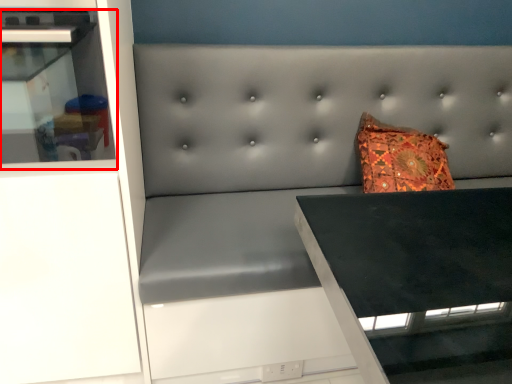
Question: From the image's perspective, what is the correct spatial positioning of shelf (annotated by the red box) in reference to cabinetry?

Choices:
 (A) above
 (B) below

Answer: (A)